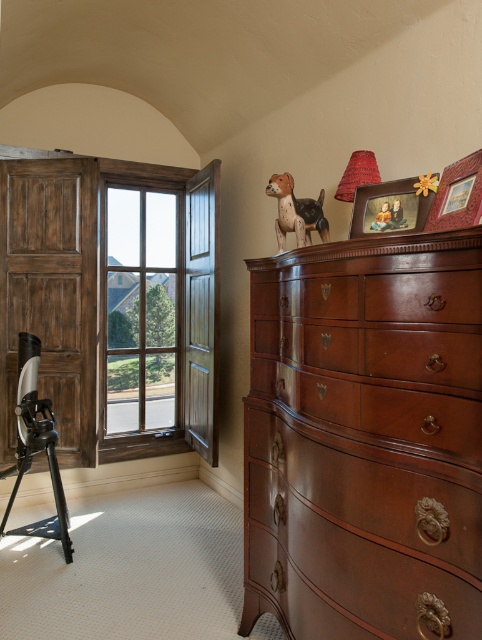
Can you confirm if mahogany wood dresser at right is taller than wooden picture frame at upper right?

Correct, mahogany wood dresser at right is much taller as wooden picture frame at upper right.

Can you confirm if mahogany wood dresser at right is thinner than wooden picture frame at upper right?

No.

The width and height of the screenshot is (482, 640). In order to click on mahogany wood dresser at right in this screenshot , I will do `click(364, 436)`.

Looking at this image, can you confirm if black matte tripod at left is positioned to the left of wooden picture frame at upper center?

Correct, you'll find black matte tripod at left to the left of wooden picture frame at upper center.

Is point (50, 532) behind point (407, 177)?

Yes, it is.

Is point (12, 472) farther from camera compared to point (422, 221)?

Yes, point (12, 472) is farther from viewer.

At what (x,y) coordinates should I click in order to perform the action: click on black matte tripod at left. Please return your answer as a coordinate pair (x, y). This screenshot has height=640, width=482. Looking at the image, I should click on (36, 445).

Consider the image. Who is shorter, clear glass window at center or wooden picture frame at upper center?

Standing shorter between the two is wooden picture frame at upper center.

From the picture: Can you confirm if clear glass window at center is taller than wooden picture frame at upper center?

Correct, clear glass window at center is much taller as wooden picture frame at upper center.

Who is more forward, (x=151, y=244) or (x=363, y=221)?

Point (x=363, y=221) is more forward.

I want to click on clear glass window at center, so click(x=141, y=308).